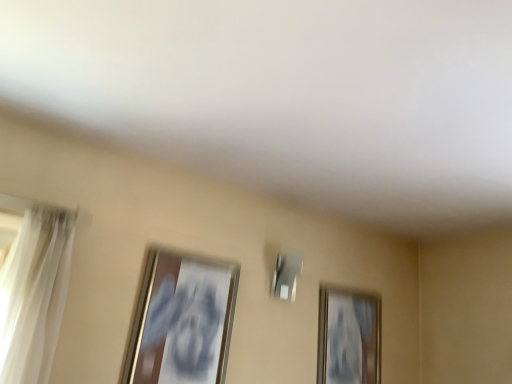
Locate an element on the screen. white sheer curtain at left is located at coordinates (35, 294).

From a real-world perspective, is gold metallic picture frame at upper right, the 2th picture frame viewed from the left, above or below metallic silver picture frame at left, the first picture frame positioned from the left?

From a real-world perspective, gold metallic picture frame at upper right, the 2th picture frame viewed from the left, is physically above metallic silver picture frame at left, the first picture frame positioned from the left.

Looking at this image, is gold metallic picture frame at upper right, which appears as the 1th picture frame when viewed from the right, with metallic silver picture frame at left, the first picture frame positioned from the left?

There is a gap between gold metallic picture frame at upper right, which appears as the 1th picture frame when viewed from the right, and metallic silver picture frame at left, the first picture frame positioned from the left.

Is the position of gold metallic picture frame at upper right, the second picture frame positioned from the front, less distant than that of metallic silver picture frame at left, the first picture frame positioned from the left?

No, it is behind metallic silver picture frame at left, the first picture frame positioned from the left.

Considering the relative sizes of gold metallic picture frame at upper right, placed as the 1th picture frame when sorted from back to front, and metallic silver picture frame at left, the first picture frame positioned from the left, in the image provided, is gold metallic picture frame at upper right, placed as the 1th picture frame when sorted from back to front, shorter than metallic silver picture frame at left, the first picture frame positioned from the left,?

Correct, gold metallic picture frame at upper right, placed as the 1th picture frame when sorted from back to front, is not as tall as metallic silver picture frame at left, the first picture frame positioned from the left.

Considering the sizes of objects metallic silver picture frame at left, arranged as the first picture frame when viewed from the front, and gold metallic picture frame at upper right, placed as the 1th picture frame when sorted from back to front, in the image provided, who is bigger, metallic silver picture frame at left, arranged as the first picture frame when viewed from the front, or gold metallic picture frame at upper right, placed as the 1th picture frame when sorted from back to front,?

gold metallic picture frame at upper right, placed as the 1th picture frame when sorted from back to front, is bigger.

From a real-world perspective, between metallic silver picture frame at left, the 2th picture frame from the right, and gold metallic picture frame at upper right, placed as the 1th picture frame when sorted from back to front, who is vertically higher?

gold metallic picture frame at upper right, placed as the 1th picture frame when sorted from back to front, is physically above.

In the scene shown: Is metallic silver picture frame at left, the 2th picture frame from the right, not close to gold metallic picture frame at upper right, the second picture frame positioned from the front?

Yes, metallic silver picture frame at left, the 2th picture frame from the right, and gold metallic picture frame at upper right, the second picture frame positioned from the front, are quite far apart.

I want to click on curtain lying in front of the gold metallic picture frame at upper right, placed as the 1th picture frame when sorted from back to front, so click(x=35, y=294).

From a real-world perspective, between white sheer curtain at left and gold metallic picture frame at upper right, which appears as the 1th picture frame when viewed from the right, who is vertically lower?

In real-world perspective, white sheer curtain at left is lower.

Considering the relative sizes of white sheer curtain at left and gold metallic picture frame at upper right, the 2th picture frame viewed from the left, in the image provided, is white sheer curtain at left thinner than gold metallic picture frame at upper right, the 2th picture frame viewed from the left,?

No, white sheer curtain at left is not thinner than gold metallic picture frame at upper right, the 2th picture frame viewed from the left.

Which is in front, white sheer curtain at left or gold metallic picture frame at upper right, the 2th picture frame viewed from the left?

white sheer curtain at left.

Can you confirm if metallic silver picture frame at left, arranged as the first picture frame when viewed from the front, is thinner than white sheer curtain at left?

Indeed, metallic silver picture frame at left, arranged as the first picture frame when viewed from the front, has a lesser width compared to white sheer curtain at left.

Is metallic silver picture frame at left, arranged as the first picture frame when viewed from the front, closer to camera compared to white sheer curtain at left?

No.

Can you confirm if metallic silver picture frame at left, the first picture frame positioned from the left, is positioned to the left of white sheer curtain at left?

No, metallic silver picture frame at left, the first picture frame positioned from the left, is not to the left of white sheer curtain at left.

What's the angular difference between white sheer curtain at left and metallic silver picture frame at left, the first picture frame positioned from the left,'s facing directions?

0.866 degrees.

From the image's perspective, between white sheer curtain at left and metallic silver picture frame at left, the 2th picture frame from the back, who is located below?

metallic silver picture frame at left, the 2th picture frame from the back, is shown below in the image.

How distant is white sheer curtain at left from metallic silver picture frame at left, arranged as the first picture frame when viewed from the front?

They are 24.79 inches apart.

Is white sheer curtain at left situated inside metallic silver picture frame at left, the 2th picture frame from the right, or outside?

A: white sheer curtain at left is located beyond the bounds of metallic silver picture frame at left, the 2th picture frame from the right.

Based on the photo, in terms of size, does gold metallic picture frame at upper right, the second picture frame positioned from the front, appear bigger or smaller than white sheer curtain at left?

Clearly, gold metallic picture frame at upper right, the second picture frame positioned from the front, is smaller in size than white sheer curtain at left.

Is gold metallic picture frame at upper right, the 2th picture frame viewed from the left, further to camera compared to white sheer curtain at left?

Yes, gold metallic picture frame at upper right, the 2th picture frame viewed from the left, is behind white sheer curtain at left.

Does point (343, 381) come closer to viewer compared to point (29, 328)?

No, (343, 381) is behind (29, 328).

Where is `picture frame in front of the gold metallic picture frame at upper right, the second picture frame positioned from the front`? The width and height of the screenshot is (512, 384). picture frame in front of the gold metallic picture frame at upper right, the second picture frame positioned from the front is located at coordinates (182, 320).

The height and width of the screenshot is (384, 512). Find the location of `picture frame to the right of metallic silver picture frame at left, the 2th picture frame from the right`. picture frame to the right of metallic silver picture frame at left, the 2th picture frame from the right is located at coordinates (349, 336).

Considering their positions, is white sheer curtain at left positioned closer to gold metallic picture frame at upper right, which appears as the 1th picture frame when viewed from the right, than metallic silver picture frame at left, the first picture frame positioned from the left?

Among the two, metallic silver picture frame at left, the first picture frame positioned from the left, is located nearer to gold metallic picture frame at upper right, which appears as the 1th picture frame when viewed from the right.

Estimate the real-world distances between objects in this image. Which object is further from metallic silver picture frame at left, the 2th picture frame from the right, white sheer curtain at left or gold metallic picture frame at upper right, which appears as the 1th picture frame when viewed from the right?

Based on the image, gold metallic picture frame at upper right, which appears as the 1th picture frame when viewed from the right, appears to be further to metallic silver picture frame at left, the 2th picture frame from the right.

Considering their positions, is gold metallic picture frame at upper right, which appears as the 1th picture frame when viewed from the right, positioned further to white sheer curtain at left than metallic silver picture frame at left, the first picture frame positioned from the left?

gold metallic picture frame at upper right, which appears as the 1th picture frame when viewed from the right, is positioned further to the anchor white sheer curtain at left.

Looking at the image, which one is located closer to metallic silver picture frame at left, the first picture frame positioned from the left, gold metallic picture frame at upper right, the 2th picture frame viewed from the left, or white sheer curtain at left?

Based on the image, white sheer curtain at left appears to be nearer to metallic silver picture frame at left, the first picture frame positioned from the left.

Based on their spatial positions, is metallic silver picture frame at left, arranged as the first picture frame when viewed from the front, or white sheer curtain at left further from gold metallic picture frame at upper right, the 2th picture frame viewed from the left?

white sheer curtain at left is positioned further to the anchor gold metallic picture frame at upper right, the 2th picture frame viewed from the left.

When comparing their distances from white sheer curtain at left, does metallic silver picture frame at left, arranged as the first picture frame when viewed from the front, or gold metallic picture frame at upper right, which appears as the 1th picture frame when viewed from the right, seem further?

gold metallic picture frame at upper right, which appears as the 1th picture frame when viewed from the right, is further to white sheer curtain at left.

Find the location of a particular element. This screenshot has height=384, width=512. picture frame situated between white sheer curtain at left and gold metallic picture frame at upper right, the second picture frame positioned from the front, from left to right is located at coordinates 182,320.